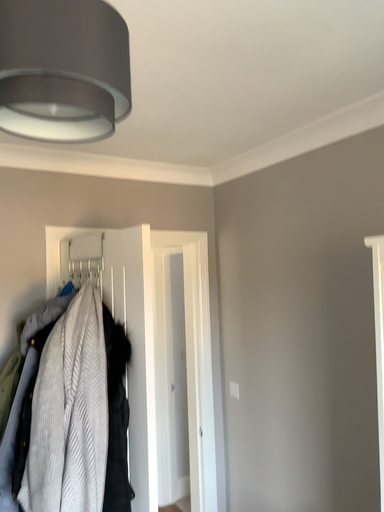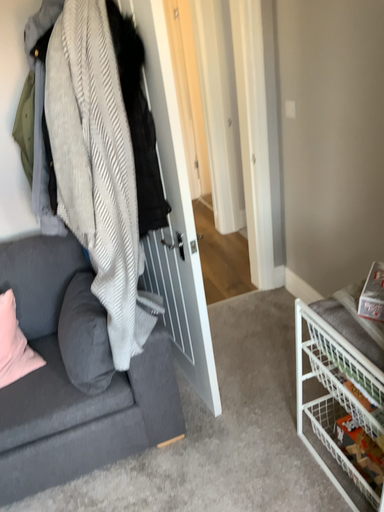
Question: Which way did the camera rotate in the video?

Choices:
 (A) rotated downward
 (B) rotated upward

Answer: (A)